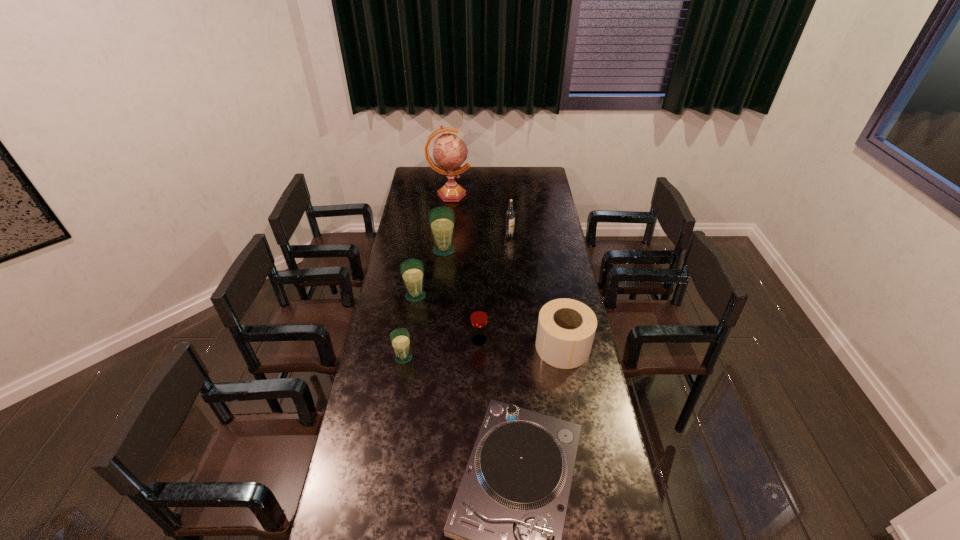
Identify the location of pink globe. The width and height of the screenshot is (960, 540). (449, 152).

I want to click on the farthest object, so click(x=449, y=152).

This screenshot has width=960, height=540. What are the coordinates of `the farthest glass` in the screenshot? It's located at (441, 219).

At what (x,y) coordinates should I click in order to perform the action: click on the farthest blue glass. Please return your answer as a coordinate pair (x, y). Looking at the image, I should click on (441, 219).

You are a GUI agent. You are given a task and a screenshot of the screen. Output one action in this format:
    pyautogui.click(x=<x>, y=<y>)
    Task: Click on the vodka
    Image resolution: width=960 pixels, height=540 pixels.
    Given the screenshot: What is the action you would take?
    pyautogui.click(x=510, y=214)

You are a GUI agent. You are given a task and a screenshot of the screen. Output one action in this format:
    pyautogui.click(x=<x>, y=<y>)
    Task: Click on the rightmost glass
    The image size is (960, 540).
    Given the screenshot: What is the action you would take?
    pyautogui.click(x=478, y=317)

At what (x,y) coordinates should I click in order to perform the action: click on red glass. Please return your answer as a coordinate pair (x, y). Looking at the image, I should click on (478, 317).

Locate an element on the screen. the second smallest blue glass is located at coordinates (412, 270).

You are a GUI agent. You are given a task and a screenshot of the screen. Output one action in this format:
    pyautogui.click(x=<x>, y=<y>)
    Task: Click on the second farthest blue glass
    
    Given the screenshot: What is the action you would take?
    pyautogui.click(x=412, y=270)

This screenshot has height=540, width=960. I want to click on toilet tissue, so click(x=566, y=328).